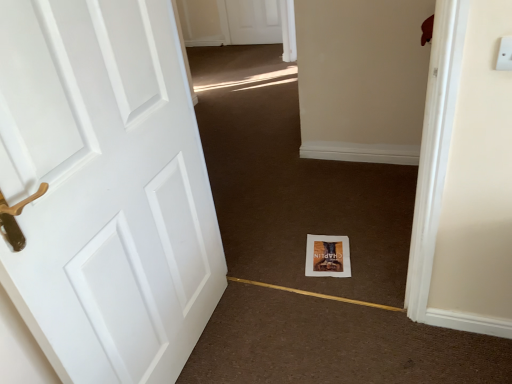
Image resolution: width=512 pixels, height=384 pixels. In order to click on vacant space to the right of matte paper book at center in this screenshot , I will do `click(375, 249)`.